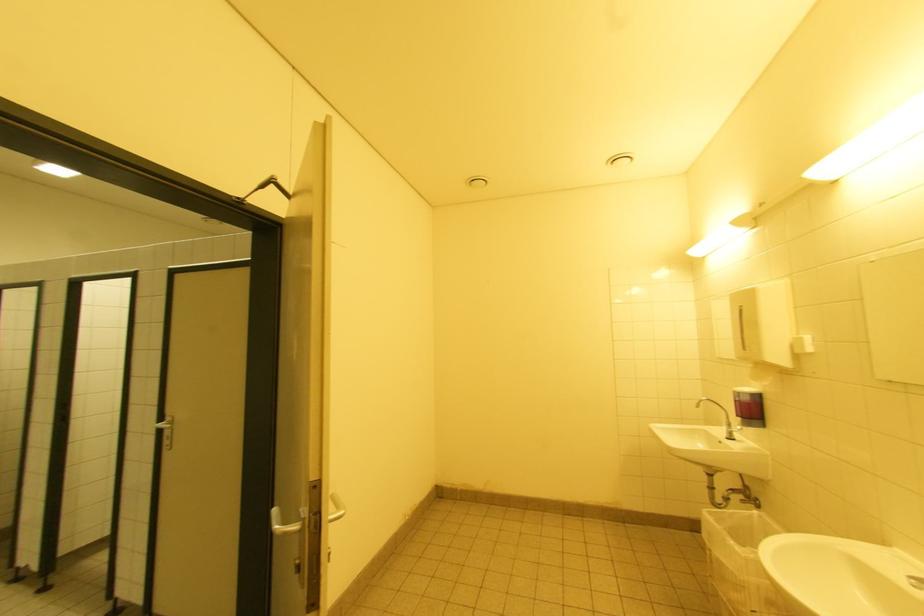
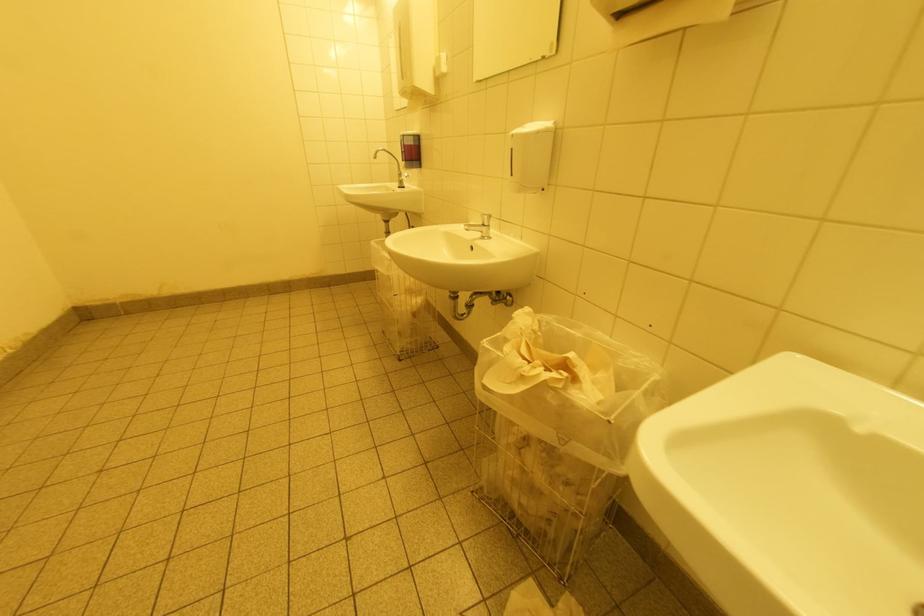
From the picture: The images are taken continuously from a first-person perspective. In which direction is your viewpoint rotating?

The camera's rotation is toward right-down.